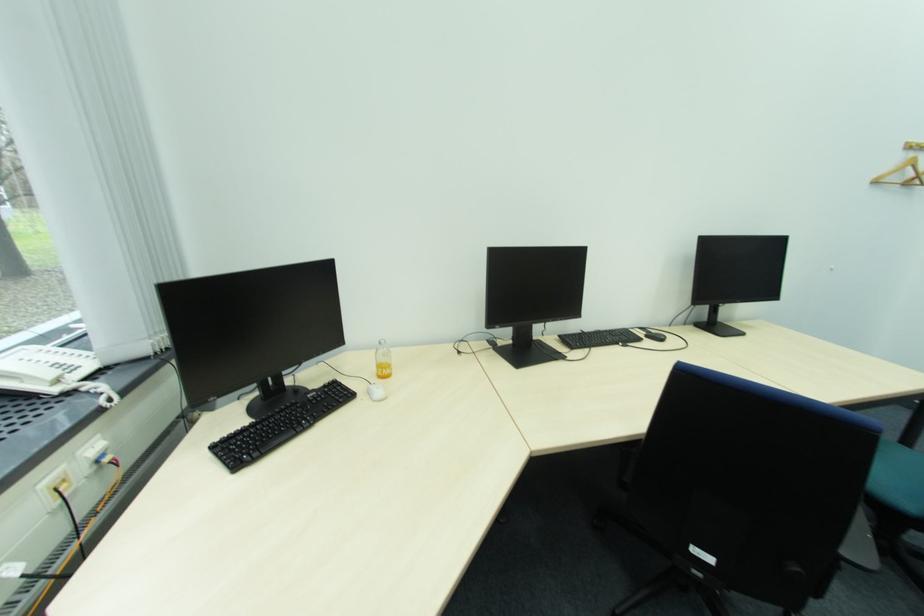
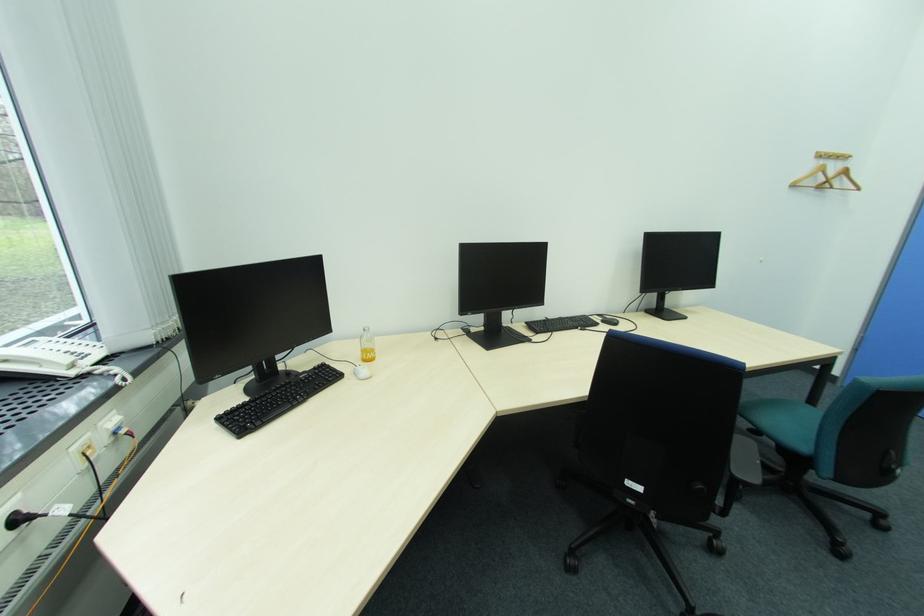
Where in the second image is the point corresponding to pixel 375 392 from the first image?

(361, 374)